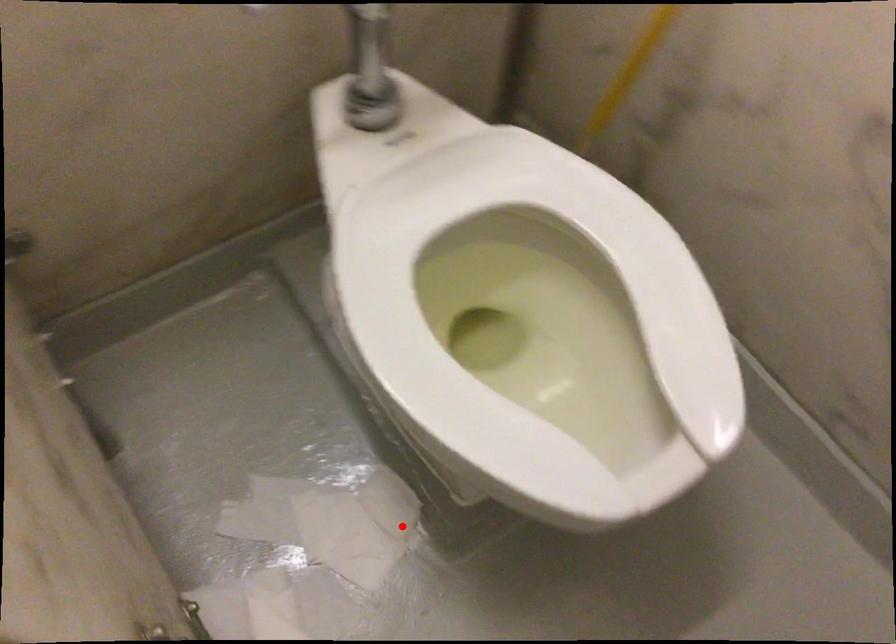
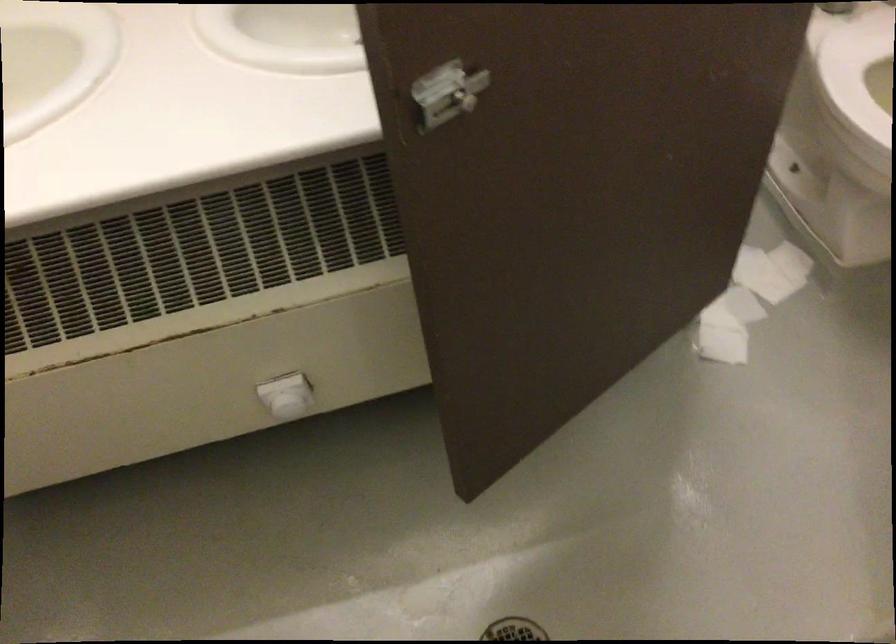
Question: I am providing you with two images of the same scene from different viewpoints. Given a red point in image1, look at the same physical point in image2. Is it:

Choices:
 (A) Closer to the viewpoint
 (B) Farther from the viewpoint

Answer: (B)